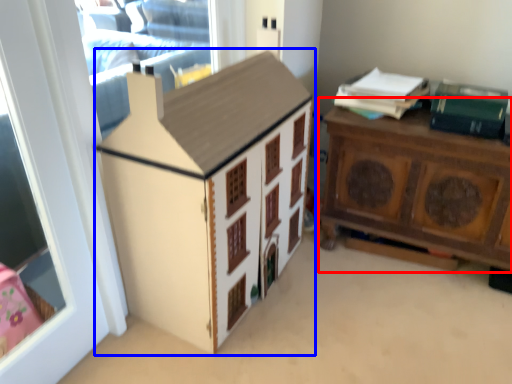
Question: Which object appears farthest to the camera in this image, nightstand (highlighted by a red box) or cabinetry (highlighted by a blue box)?

Choices:
 (A) nightstand
 (B) cabinetry

Answer: (A)